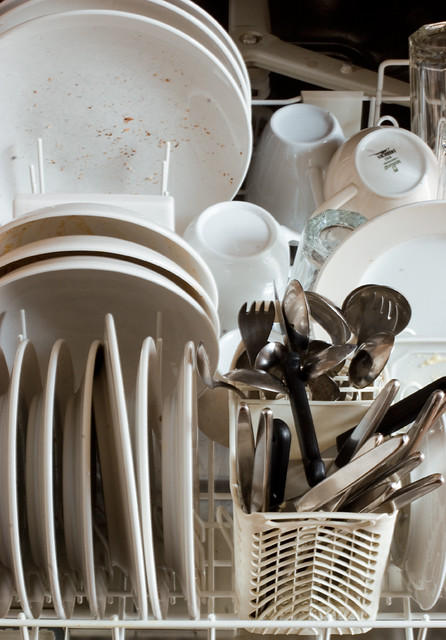
I want to click on cups, so click(431, 81), click(406, 154), click(319, 136), click(326, 220), click(234, 227), click(227, 349).